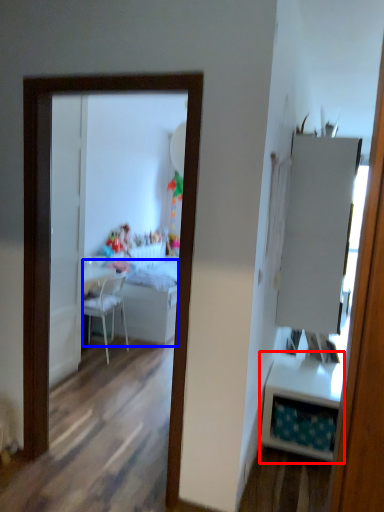
Question: Which object is further to the camera taking this photo, table (highlighted by a red box) or table (highlighted by a blue box)?

Choices:
 (A) table
 (B) table

Answer: (B)